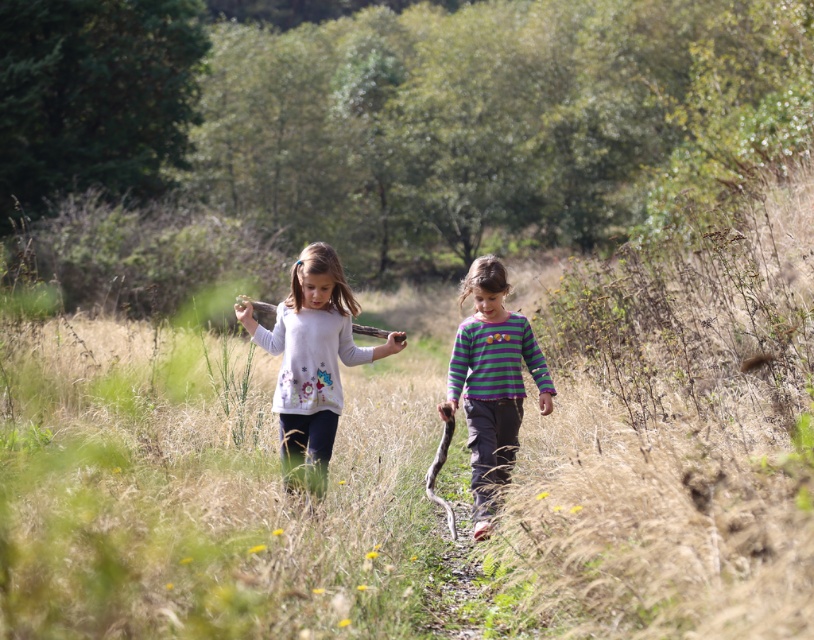
Does white matte sweater at center have a lesser height compared to striped cotton shirt at center?

Indeed, white matte sweater at center has a lesser height compared to striped cotton shirt at center.

Is white matte sweater at center taller than striped cotton shirt at center?

Incorrect, white matte sweater at center's height is not larger of striped cotton shirt at center's.

Is point (305, 284) farther from camera compared to point (484, 435)?

No.

Where is `white matte sweater at center`? white matte sweater at center is located at coordinates (311, 362).